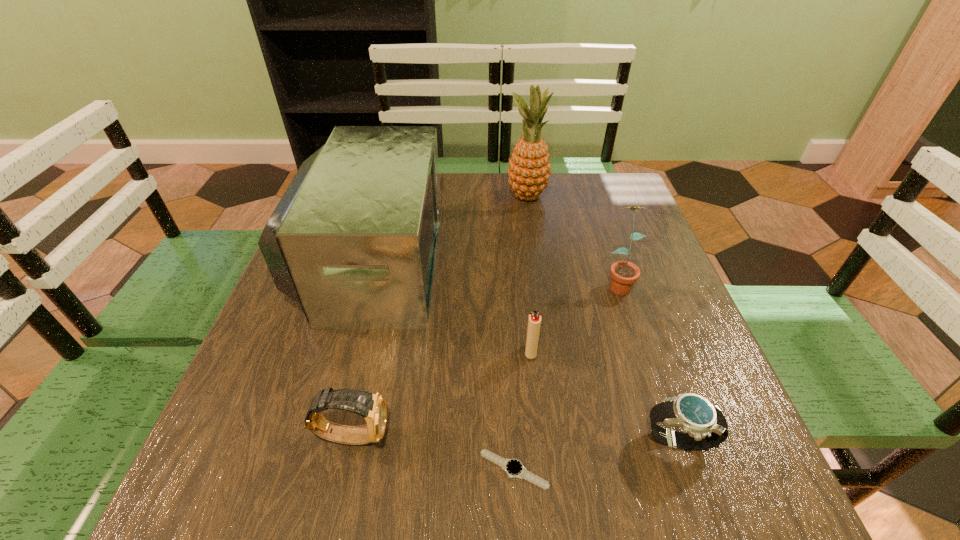
You are a GUI agent. You are given a task and a screenshot of the screen. Output one action in this format:
    pyautogui.click(x=<x>, y=<y>)
    Task: Click on the sunflower that is at the right edge
    The image size is (960, 540).
    Given the screenshot: What is the action you would take?
    pyautogui.click(x=624, y=274)

Find the location of a particular element. watch at the right edge is located at coordinates (704, 426).

What are the coordinates of `object present at the far left corner` in the screenshot? It's located at pos(353,240).

This screenshot has width=960, height=540. Find the location of `object present at the near right corner`. object present at the near right corner is located at coordinates (704, 426).

In the image, there is a desktop. Find the location of `vacant space at the far edge`. vacant space at the far edge is located at coordinates (557, 197).

Where is `vacant space at the near edge`? vacant space at the near edge is located at coordinates (555, 472).

Image resolution: width=960 pixels, height=540 pixels. I want to click on vacant area at the left edge of the desktop, so click(x=246, y=421).

Locate an element on the screen. The height and width of the screenshot is (540, 960). free space at the right edge of the desktop is located at coordinates (652, 376).

You are a GUI agent. You are given a task and a screenshot of the screen. Output one action in this format:
    pyautogui.click(x=<x>, y=<y>)
    Task: Click on the blank space at the near right corner
    
    Given the screenshot: What is the action you would take?
    pyautogui.click(x=708, y=461)

Find the location of a particular element. free space between the third tallest object and the igniter is located at coordinates (574, 317).